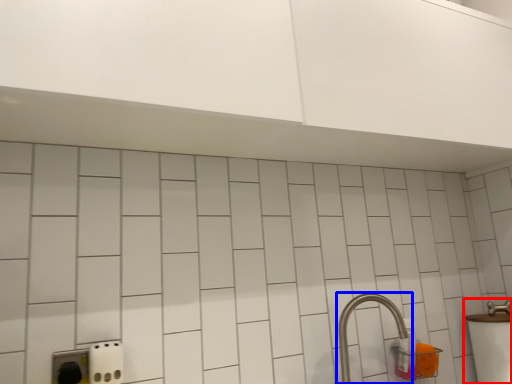
Question: Which object appears closest to the camera in this image, sink (highlighted by a red box) or tap (highlighted by a blue box)?

Choices:
 (A) sink
 (B) tap

Answer: (B)